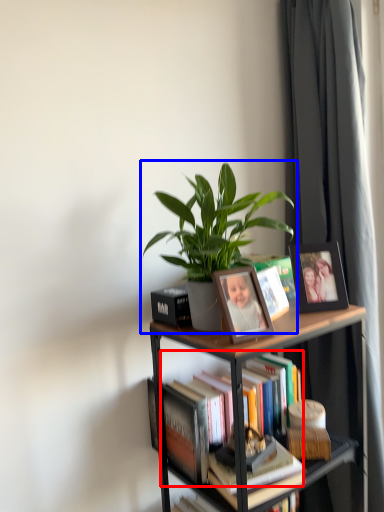
Question: Which point is further to the camera, book (highlighted by a red box) or houseplant (highlighted by a blue box)?

Choices:
 (A) book
 (B) houseplant

Answer: (A)